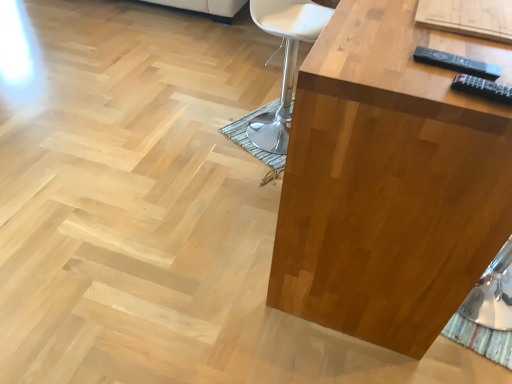
Question: Considering the relative positions of black plastic remote at upper right, the 1th remote positioned from the back, and white leather chair at center in the image provided, is black plastic remote at upper right, the 1th remote positioned from the back, to the left of white leather chair at center from the viewer's perspective?

Choices:
 (A) no
 (B) yes

Answer: (A)

Question: Does black plastic remote at upper right, which appears as the second remote when viewed from the front, lie in front of white leather chair at center?

Choices:
 (A) yes
 (B) no

Answer: (A)

Question: Is black plastic remote at upper right, the 1th remote positioned from the back, oriented away from white leather chair at center?

Choices:
 (A) no
 (B) yes

Answer: (A)

Question: From a real-world perspective, is black plastic remote at upper right, the first remote in the top-to-bottom sequence, over white leather chair at center?

Choices:
 (A) no
 (B) yes

Answer: (B)

Question: Does black plastic remote at upper right, the first remote in the top-to-bottom sequence, have a lesser width compared to white leather chair at center?

Choices:
 (A) no
 (B) yes

Answer: (B)

Question: Considering the relative positions of satin wood table at right and black plastic remote at upper right, the first remote in the top-to-bottom sequence, in the image provided, is satin wood table at right to the left or to the right of black plastic remote at upper right, the first remote in the top-to-bottom sequence,?

Choices:
 (A) left
 (B) right

Answer: (B)

Question: In the image, is satin wood table at right positioned in front of or behind black plastic remote at upper right, which appears as the second remote when viewed from the front?

Choices:
 (A) behind
 (B) front

Answer: (B)

Question: Looking at their shapes, would you say satin wood table at right is wider or thinner than black plastic remote at upper right, positioned as the second remote in bottom-to-top order?

Choices:
 (A) wide
 (B) thin

Answer: (A)

Question: From a real-world perspective, is satin wood table at right physically located above or below black plastic remote at upper right, the 1th remote positioned from the back?

Choices:
 (A) below
 (B) above

Answer: (A)

Question: Is black plastic remote at upper right, the first remote in the top-to-bottom sequence, inside the boundaries of satin wood table at right, or outside?

Choices:
 (A) inside
 (B) outside

Answer: (A)

Question: Looking at the image, does black plastic remote at upper right, the first remote in the top-to-bottom sequence, seem bigger or smaller compared to satin wood table at right?

Choices:
 (A) big
 (B) small

Answer: (B)

Question: In terms of height, does black plastic remote at upper right, the 1th remote positioned from the back, look taller or shorter compared to satin wood table at right?

Choices:
 (A) short
 (B) tall

Answer: (A)

Question: Is black plastic remote at upper right, the 1th remote positioned from the back, to the left or to the right of satin wood table at right in the image?

Choices:
 (A) left
 (B) right

Answer: (A)

Question: Is point (487, 77) closer or farther from the camera than point (276, 140)?

Choices:
 (A) closer
 (B) farther

Answer: (A)

Question: Is black plastic remote at upper right, the first remote in the top-to-bottom sequence, wider or thinner than white leather chair at center?

Choices:
 (A) thin
 (B) wide

Answer: (A)